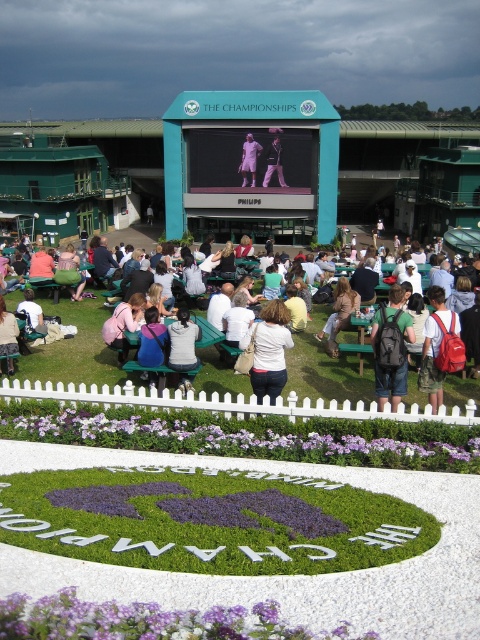
You are a photographer at the event and want to capture both the purple leafy plant at lower center and the purple matte flower at lower center in a single shot. Which one should you focus on first to ensure both are in frame?

You should focus on the purple matte flower at lower center first because the purple leafy plant at lower center is positioned to its right, so by centering the flower, the plant will naturally fall into the frame as well.